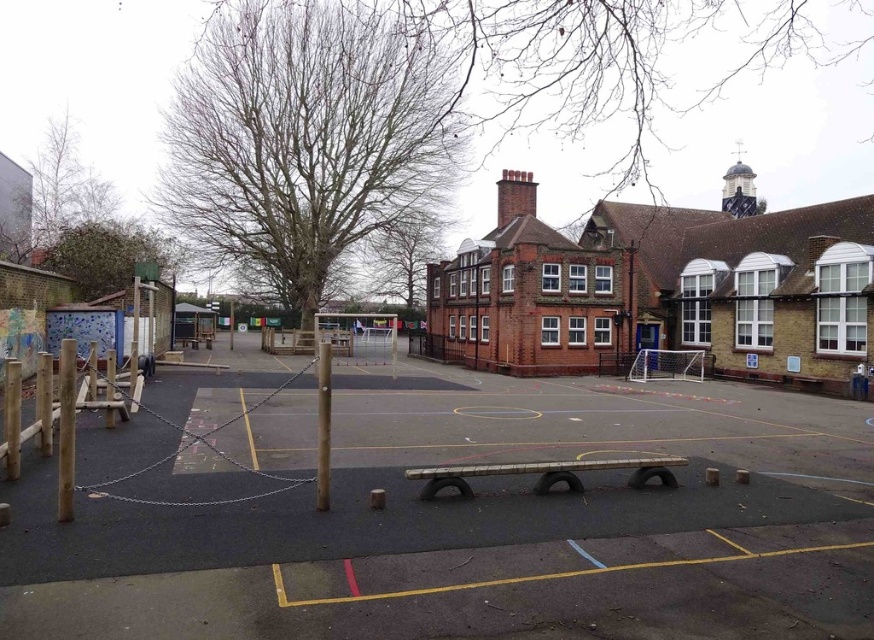
You are a parent trying to park your car in the smooth asphalt parking lot at center. You see the wooden pole at left nearby. Which direction should you turn to reach the parking lot from the wooden pole?

You should turn to the right from the wooden pole at left to reach the smooth asphalt parking lot at center because the parking lot is located to the right of the wooden pole.

You are a child trying to decide between playing on the smooth asphalt parking lot at center or climbing the wooden pole at left. Which one is taller?

The wooden pole at left is taller than the smooth asphalt parking lot at center.

You are a maintenance worker who needs to replace a loose chain connecting the wooden pole at left and wooden pole at center. The replacement chain you have is 4 meters long. Will this chain be sufficient to connect them without needing to shorten it?

The distance between the wooden pole at left and wooden pole at center is 4.70 meters. The replacement chain is only 4 meters long, which is shorter than the required distance. Therefore, the chain will not be sufficient and will need to be shortened or a longer chain must be obtained.